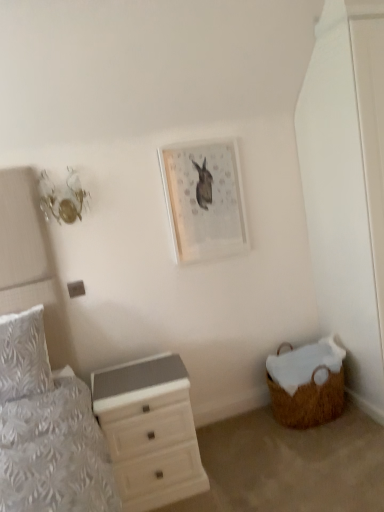
Question: Is white textured pillow at left looking in the opposite direction of matte white picture frame at upper center?

Choices:
 (A) no
 (B) yes

Answer: (A)

Question: Are white textured pillow at left and matte white picture frame at upper center beside each other?

Choices:
 (A) no
 (B) yes

Answer: (A)

Question: Can you confirm if white textured pillow at left is positioned to the left of matte white picture frame at upper center?

Choices:
 (A) no
 (B) yes

Answer: (B)

Question: Is white textured pillow at left not within matte white picture frame at upper center?

Choices:
 (A) no
 (B) yes

Answer: (B)

Question: Does white textured pillow at left have a greater width compared to matte white picture frame at upper center?

Choices:
 (A) no
 (B) yes

Answer: (B)

Question: From the image's perspective, relative to woven brown basket at lower right, is white glossy chest of drawers at lower left above or below?

Choices:
 (A) below
 (B) above

Answer: (A)

Question: Relative to woven brown basket at lower right, is white glossy chest of drawers at lower left in front or behind?

Choices:
 (A) behind
 (B) front

Answer: (B)

Question: Based on their sizes in the image, would you say white glossy chest of drawers at lower left is bigger or smaller than woven brown basket at lower right?

Choices:
 (A) big
 (B) small

Answer: (A)

Question: In the image, is white glossy chest of drawers at lower left on the left side or the right side of woven brown basket at lower right?

Choices:
 (A) right
 (B) left

Answer: (B)

Question: In terms of height, does white glossy chest of drawers at lower left look taller or shorter compared to white textured pillow at left?

Choices:
 (A) short
 (B) tall

Answer: (B)

Question: Is white glossy chest of drawers at lower left in front of or behind white textured pillow at left in the image?

Choices:
 (A) front
 (B) behind

Answer: (A)

Question: Based on their sizes in the image, would you say white glossy chest of drawers at lower left is bigger or smaller than white textured pillow at left?

Choices:
 (A) big
 (B) small

Answer: (A)

Question: Would you say white glossy chest of drawers at lower left is to the left or to the right of white textured pillow at left in the picture?

Choices:
 (A) left
 (B) right

Answer: (B)

Question: From the image's perspective, is woven brown basket at lower right above or below white glossy chest of drawers at lower left?

Choices:
 (A) above
 (B) below

Answer: (A)

Question: Is woven brown basket at lower right taller or shorter than white glossy chest of drawers at lower left?

Choices:
 (A) short
 (B) tall

Answer: (A)